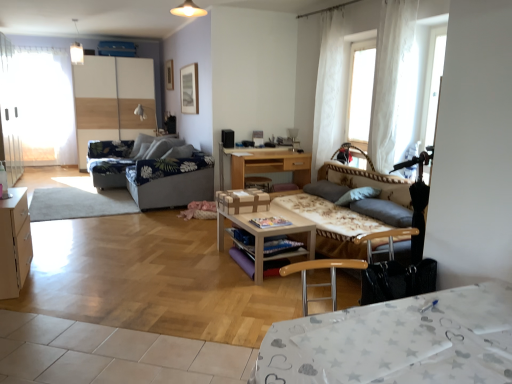
Question: In terms of height, does wooden desk at center, the first table positioned from the back, look taller or shorter compared to white sheer curtain at upper right, the second curtain positioned from the front?

Choices:
 (A) short
 (B) tall

Answer: (A)

Question: Do you think wooden desk at center, the first table positioned from the back, is within white sheer curtain at upper right, the second curtain positioned from the front, or outside of it?

Choices:
 (A) inside
 (B) outside

Answer: (B)

Question: Which object is the farthest from the wooden picture frame at upper center?

Choices:
 (A) light wood cabinet at left
 (B) white sheer curtain at upper right, placed as the 1th curtain when sorted from right to left
 (C) white sheer curtain at upper right, which is the 1th curtain from back to front
 (D) blue floral fabric studio couch at center-left, marked as the 1th studio couch in a back-to-front arrangement
 (E) white glossy table at lower right

Answer: (E)

Question: Which is farther from the white sheer curtain at upper right, placed as the second curtain when sorted from back to front?

Choices:
 (A) light wood cabinet at left
 (B) floral fabric studio couch at center, which appears as the 1th studio couch when viewed from the right
 (C) white sheer curtain at upper right, positioned as the second curtain in right-to-left order
 (D) wooden picture frame at upper center
 (E) white glossy dresser at left

Answer: (E)